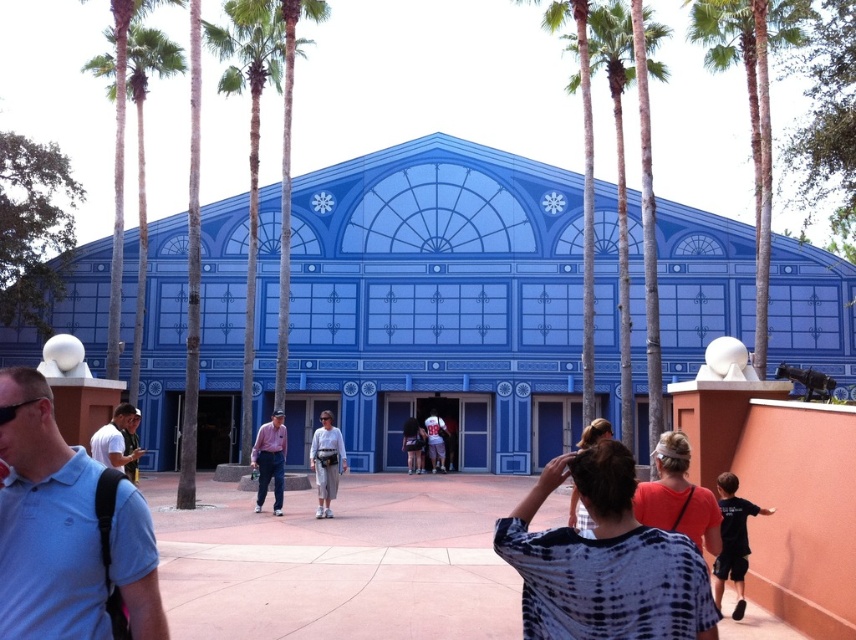
In the scene shown: You are standing in the foreground of the scene. You see a green leafy palm tree at center and a pink shirt at center. Which object is closer to you?

The green leafy palm tree at center is closer to you because the pink shirt at center is behind it.